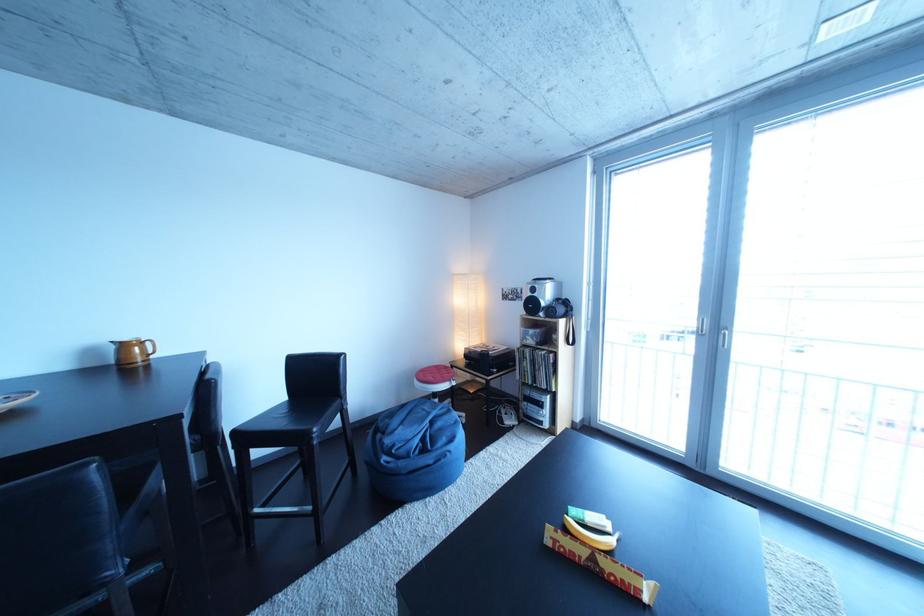
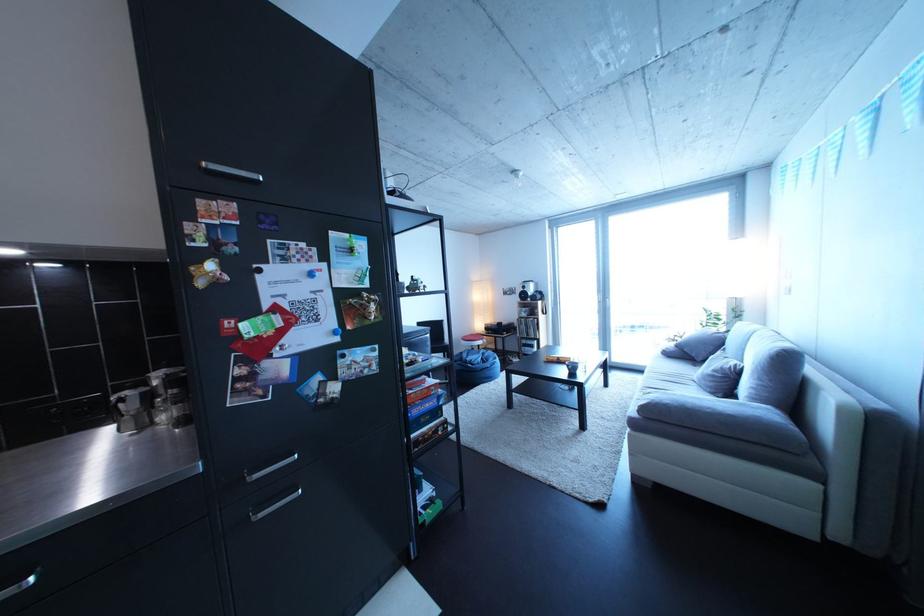
In a continuous first-person perspective shot, in which direction is the camera moving?

The cameraman walked toward left, backward.